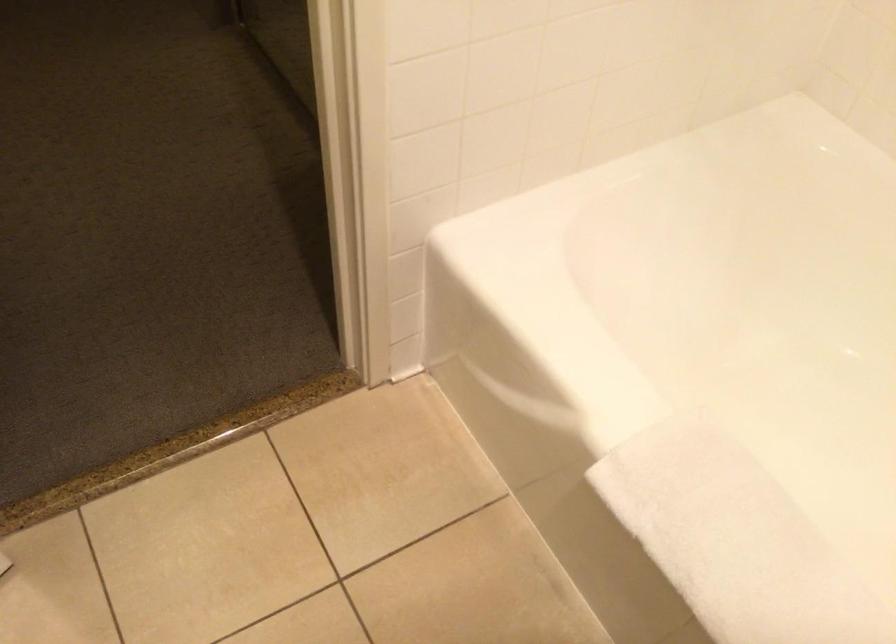
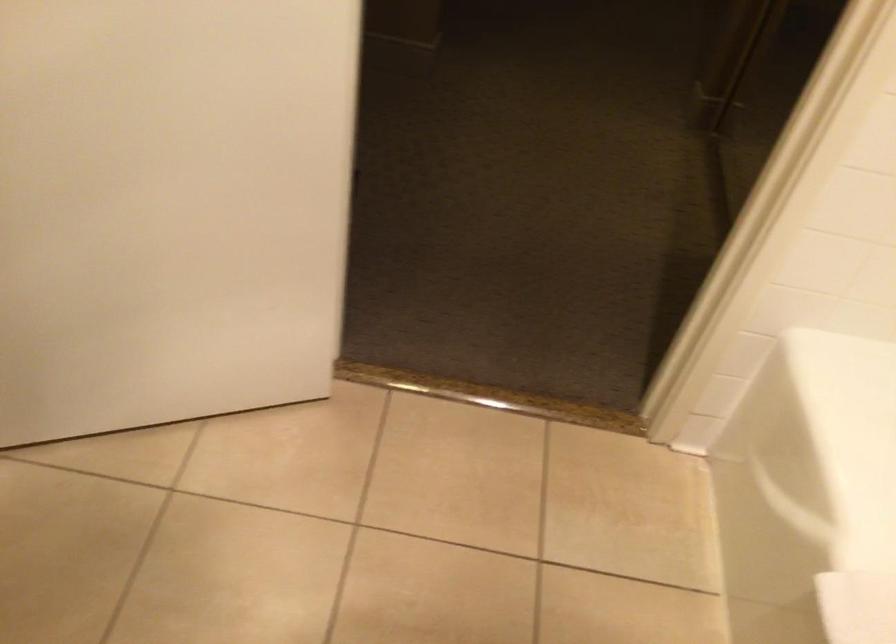
Question: Based on the continuous images, in which direction is the camera rotating? Reply with the corresponding letter.

Choices:
 (A) Left
 (B) Right
 (C) Up
 (D) Down

Answer: (A)